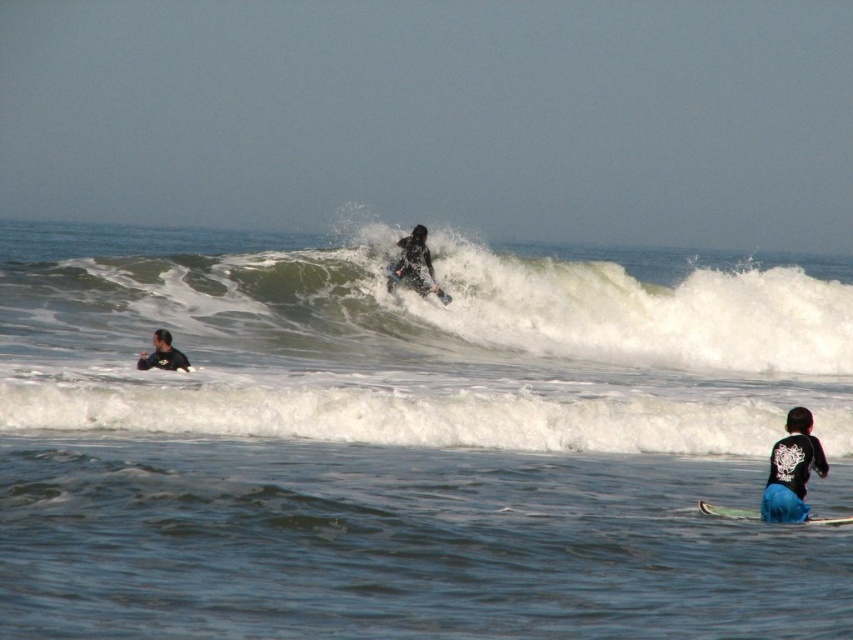
You are a photographer standing on the beach and want to capture a wide shot of the white frothy wave at center and the black wetsuit surfer at lower left. Based on their sizes, which one should you focus on to ensure it fills more of your camera frame?

The white frothy wave at center should be focused on since its width is larger than the black wetsuit surfer at lower left, making it the bigger subject in the scene.

You are a lifeguard watching the ocean scene. You see the white frothy wave at center and the black wetsuit surfer at lower left. Which object is located more to the left side?

The white frothy wave at center is positioned on the left side of black wetsuit surfer at lower left, so it is more to the left.

You are a photographer trying to capture the white frothy wave at center. Based on its position, which part of the image should you focus on to ensure it is in the frame?

The white frothy wave at center is located at point (x=418, y=305), so you should focus on the center area of the image to capture it.